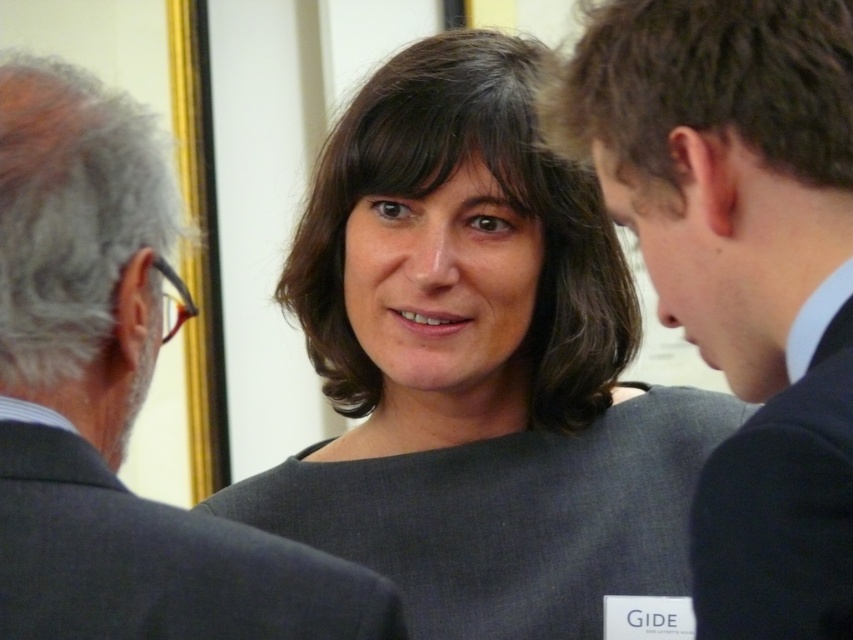
You are standing in front of the image and want to touch the black suit at center. Which direction should you move your hand to reach it?

The black suit at center is located at point 0.423 on the horizontal axis and 0.871 on the vertical axis, so you should move your hand to the right and down to reach it.